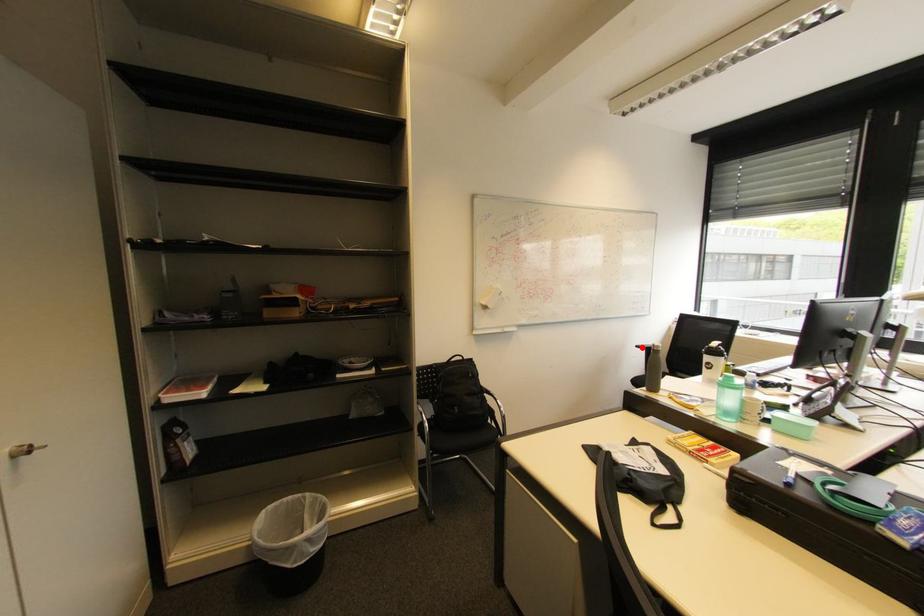
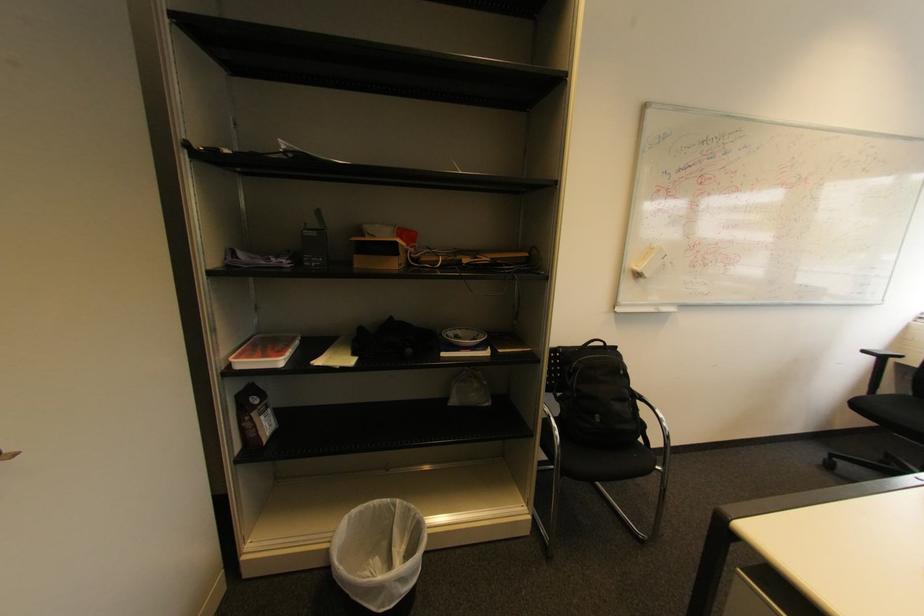
The point at the highlighted location is marked in the first image. Where is the corresponding point in the second image?

(869, 352)